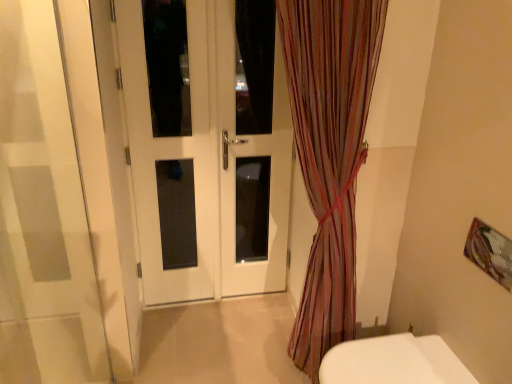
The width and height of the screenshot is (512, 384). I want to click on unoccupied area in front of white glossy door at center, so click(x=209, y=342).